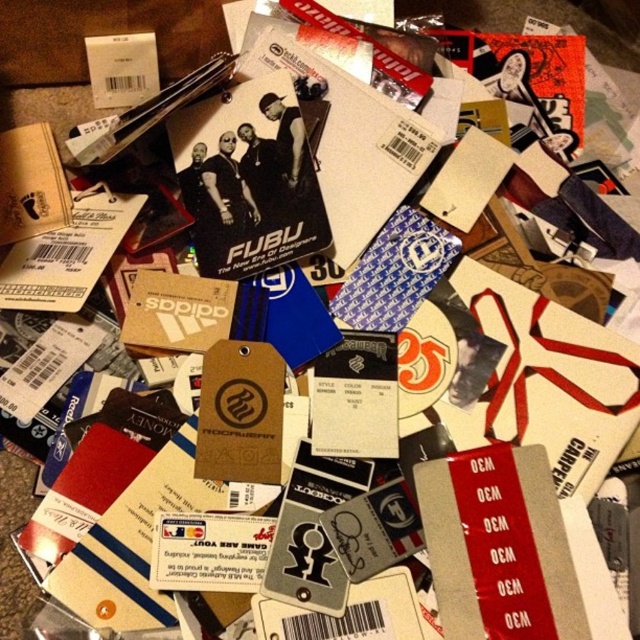
Measure the distance between matte black card at center and brown cardboard at upper left.

matte black card at center is 12.70 inches away from brown cardboard at upper left.

Does matte black card at center have a lesser width compared to brown cardboard at upper left?

Incorrect, matte black card at center's width is not less than brown cardboard at upper left's.

Which is behind, point (236, 168) or point (20, 131)?

Point (20, 131)

This screenshot has width=640, height=640. I want to click on matte black card at center, so click(x=248, y=179).